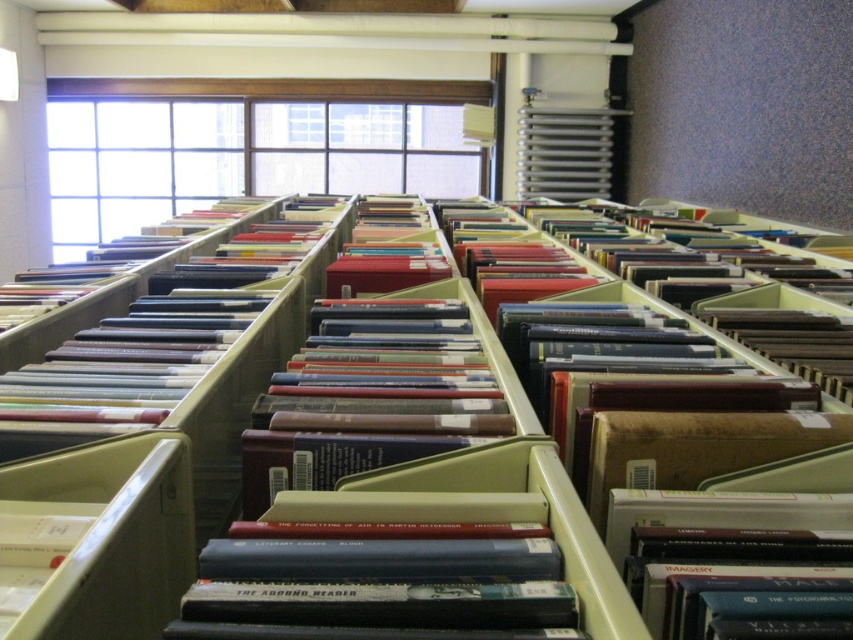
You are a librarian who needs to retrieve a folder from the center of the library section. You see the matte plastic bookshelf at center and the brown matte folder at center. Which object is closer to you?

The matte plastic bookshelf at center is closer to you because it is in front of the brown matte folder at center.

You are organizing items in a library and need to place both the matte plastic bookshelf at center and the brown matte folder at center on a shelf that can only accommodate one of them. Based on their sizes, which item should you choose to fit on the shelf?

The matte plastic bookshelf at center is wider than the brown matte folder at center, so you should choose the brown matte folder at center to fit on the shelf.